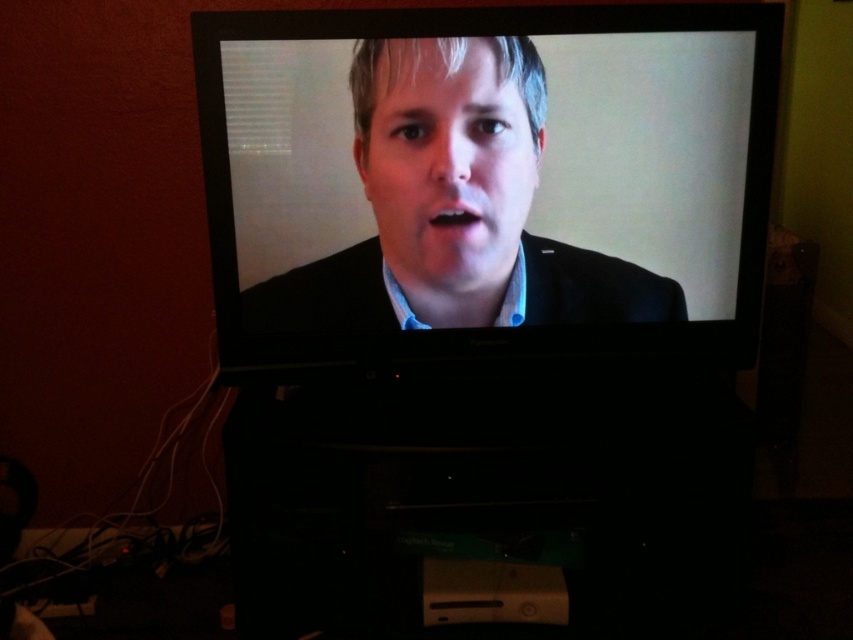
Is matte black face at center thinner than black matte business suit at center?

Correct, matte black face at center's width is less than black matte business suit at center's.

Is matte black face at center behind black matte business suit at center?

No, it is not.

Is point (444, 259) more distant than point (589, 253)?

No, it is in front of (589, 253).

Identify the location of matte black face at center. This screenshot has height=640, width=853. (445, 163).

Is matte black suit at center smaller than black matte business suit at center?

Actually, matte black suit at center might be larger than black matte business suit at center.

Which is in front, point (466, 131) or point (676, 317)?

Positioned in front is point (466, 131).

Locate an element on the screen. This screenshot has width=853, height=640. matte black suit at center is located at coordinates (456, 205).

Describe the element at coordinates (456, 205) in the screenshot. I see `matte black suit at center` at that location.

Between matte black suit at center and matte black face at center, which one appears on the left side from the viewer's perspective?

matte black face at center is more to the left.

Is point (439, 230) more distant than point (434, 141)?

Yes, it is behind point (434, 141).

Locate an element on the screen. This screenshot has height=640, width=853. matte black suit at center is located at coordinates (456, 205).